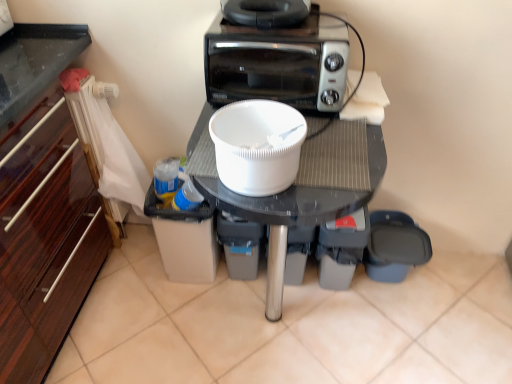
Question: Is black plastic toaster at upper center to the right of white plastic table at center from the viewer's perspective?

Choices:
 (A) yes
 (B) no

Answer: (B)

Question: Does black plastic toaster at upper center have a greater height compared to white plastic table at center?

Choices:
 (A) no
 (B) yes

Answer: (A)

Question: Is black plastic toaster at upper center in front of white plastic table at center?

Choices:
 (A) yes
 (B) no

Answer: (B)

Question: Would you consider black plastic toaster at upper center to be distant from white plastic table at center?

Choices:
 (A) no
 (B) yes

Answer: (A)

Question: Would you say black plastic toaster at upper center contains white plastic table at center?

Choices:
 (A) yes
 (B) no

Answer: (B)

Question: Relative to white plastic table at center, is white plastic bowl at center in front or behind?

Choices:
 (A) behind
 (B) front

Answer: (B)

Question: Is white plastic bowl at center taller or shorter than white plastic table at center?

Choices:
 (A) short
 (B) tall

Answer: (A)

Question: Is point (291, 130) positioned closer to the camera than point (332, 213)?

Choices:
 (A) closer
 (B) farther

Answer: (A)

Question: In terms of width, does white plastic bowl at center look wider or thinner when compared to white plastic table at center?

Choices:
 (A) thin
 (B) wide

Answer: (A)

Question: From a real-world perspective, is white plastic table at center positioned above or below black rubber toaster at upper center?

Choices:
 (A) above
 (B) below

Answer: (B)

Question: From the image's perspective, is white plastic table at center above or below black rubber toaster at upper center?

Choices:
 (A) below
 (B) above

Answer: (A)

Question: In the image, is white plastic table at center positioned in front of or behind black rubber toaster at upper center?

Choices:
 (A) behind
 (B) front

Answer: (B)

Question: Based on their sizes in the image, would you say white plastic table at center is bigger or smaller than black rubber toaster at upper center?

Choices:
 (A) small
 (B) big

Answer: (B)

Question: Considering the positions of white plastic table at center and white plastic bowl at center in the image, is white plastic table at center taller or shorter than white plastic bowl at center?

Choices:
 (A) short
 (B) tall

Answer: (B)

Question: From the image's perspective, is white plastic table at center positioned above or below white plastic bowl at center?

Choices:
 (A) above
 (B) below

Answer: (B)